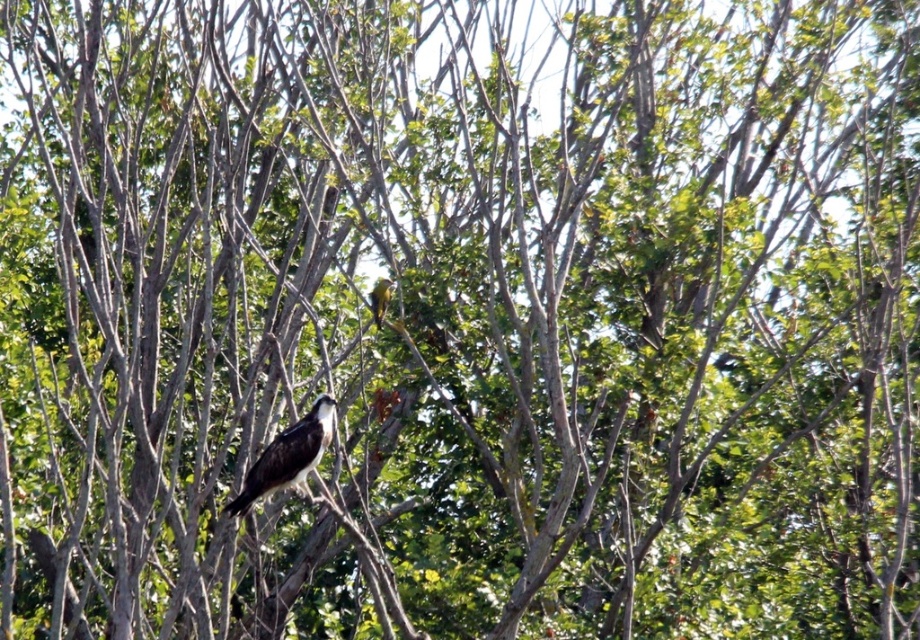
In the scene shown: You are a birdwatcher observing the scene. You notice two birds in the tree. Which bird is taller, the brown feathered bird at center or the golden yellow parrot at upper center?

The brown feathered bird at center is taller than the golden yellow parrot at upper center.

You are an ornithologist observing two birds in a tree. You notice a bird at point (331, 429) and another at point (387, 305). Which bird is closer to you?

The bird at point (331, 429) is closer to you because it is in front of the bird at point (387, 305).

You are standing 50 feet away from a tree where a brown feathered bird at center is perched. Can you tell if you are closer to the bird than 50 feet?

The brown feathered bird at center and camera are 48.42 feet apart from each other, so yes, you are closer to the bird than 50 feet.